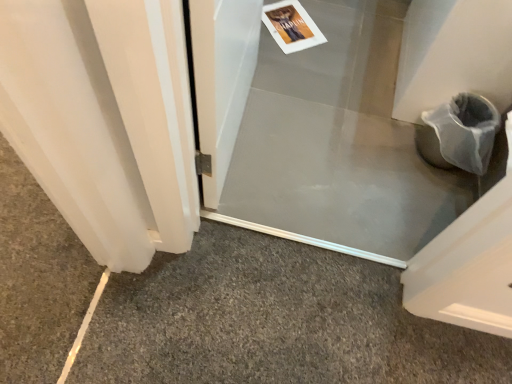
Describe the element at coordinates (222, 79) in the screenshot. Image resolution: width=512 pixels, height=384 pixels. I see `clear plastic screen door at center, the second screen door positioned from the back` at that location.

Where is `clear plastic screen door at center, marked as the 1th screen door in a front-to-back arrangement`? Image resolution: width=512 pixels, height=384 pixels. clear plastic screen door at center, marked as the 1th screen door in a front-to-back arrangement is located at coordinates (222, 79).

From a real-world perspective, is gray carpet at lower left located higher than clear plastic screen door at center, the second screen door positioned from the back?

No, from a real-world perspective, gray carpet at lower left is not above clear plastic screen door at center, the second screen door positioned from the back.

Is gray carpet at lower left not near clear plastic screen door at center, marked as the 1th screen door in a front-to-back arrangement?

No, there isn't a large distance between gray carpet at lower left and clear plastic screen door at center, marked as the 1th screen door in a front-to-back arrangement.

Considering the relative positions of gray carpet at lower left and clear plastic screen door at center, marked as the 1th screen door in a front-to-back arrangement, in the image provided, is gray carpet at lower left to the left or to the right of clear plastic screen door at center, marked as the 1th screen door in a front-to-back arrangement,?

From the image, it's evident that gray carpet at lower left is to the right of clear plastic screen door at center, marked as the 1th screen door in a front-to-back arrangement.

In the scene shown: From the image's perspective, which one is positioned lower, gray carpet at lower left or clear plastic screen door at center, the second screen door positioned from the back?

From the image's view, gray carpet at lower left is below.

Does clear plastic screen door at center, the second screen door positioned from the back, contain transparent plastic screen door at center, which is counted as the 1th screen door, starting from the back?

No, transparent plastic screen door at center, which is counted as the 1th screen door, starting from the back, is not a part of clear plastic screen door at center, the second screen door positioned from the back.

Can you tell me how much clear plastic screen door at center, marked as the 1th screen door in a front-to-back arrangement, and transparent plastic screen door at center, which ranks as the 2th screen door in front-to-back order, differ in facing direction?

The angle between the facing direction of clear plastic screen door at center, marked as the 1th screen door in a front-to-back arrangement, and the facing direction of transparent plastic screen door at center, which ranks as the 2th screen door in front-to-back order, is 93.1 degrees.

From a real-world perspective, is clear plastic screen door at center, marked as the 1th screen door in a front-to-back arrangement, under transparent plastic screen door at center, which is counted as the 1th screen door, starting from the back?

Actually, clear plastic screen door at center, marked as the 1th screen door in a front-to-back arrangement, is physically above transparent plastic screen door at center, which is counted as the 1th screen door, starting from the back, in the real world.

From the image's perspective, is clear plastic screen door at center, the second screen door positioned from the back, under transparent plastic screen door at center, which is counted as the 1th screen door, starting from the back?

Yes.

How much distance is there between gray carpet at lower left and transparent plastic screen door at center, which is counted as the 1th screen door, starting from the back?

A distance of 19.21 inches exists between gray carpet at lower left and transparent plastic screen door at center, which is counted as the 1th screen door, starting from the back.

In terms of height, does gray carpet at lower left look taller or shorter compared to transparent plastic screen door at center, which ranks as the 2th screen door in front-to-back order?

In the image, gray carpet at lower left appears to be taller than transparent plastic screen door at center, which ranks as the 2th screen door in front-to-back order.

You are a GUI agent. You are given a task and a screenshot of the screen. Output one action in this format:
    pyautogui.click(x=<x>, y=<y>)
    Task: Click on the concrete below the transparent plastic screen door at center, which is counted as the 1th screen door, starting from the back (from the image's perspective)
    
    Given the screenshot: What is the action you would take?
    pyautogui.click(x=273, y=321)

From the image's perspective, does gray carpet at lower left appear higher than transparent plastic screen door at center, which ranks as the 2th screen door in front-to-back order?

No, from the image's perspective, gray carpet at lower left is not above transparent plastic screen door at center, which ranks as the 2th screen door in front-to-back order.

Considering the relative positions of transparent plastic screen door at center, which ranks as the 2th screen door in front-to-back order, and gray carpet at lower left in the image provided, is transparent plastic screen door at center, which ranks as the 2th screen door in front-to-back order, to the left of gray carpet at lower left from the viewer's perspective?

No.

Is transparent plastic screen door at center, which is counted as the 1th screen door, starting from the back, not near gray carpet at lower left?

transparent plastic screen door at center, which is counted as the 1th screen door, starting from the back, is actually quite close to gray carpet at lower left.

Considering the sizes of objects transparent plastic screen door at center, which is counted as the 1th screen door, starting from the back, and gray carpet at lower left in the image provided, who is taller, transparent plastic screen door at center, which is counted as the 1th screen door, starting from the back, or gray carpet at lower left?

Standing taller between the two is gray carpet at lower left.

Which object is wider, transparent plastic screen door at center, which ranks as the 2th screen door in front-to-back order, or gray carpet at lower left?

transparent plastic screen door at center, which ranks as the 2th screen door in front-to-back order.

Can you confirm if transparent plastic screen door at center, which ranks as the 2th screen door in front-to-back order, is shorter than clear plastic screen door at center, marked as the 1th screen door in a front-to-back arrangement?

Indeed, transparent plastic screen door at center, which ranks as the 2th screen door in front-to-back order, has a lesser height compared to clear plastic screen door at center, marked as the 1th screen door in a front-to-back arrangement.

Could you tell me if transparent plastic screen door at center, which ranks as the 2th screen door in front-to-back order, is turned towards clear plastic screen door at center, the second screen door positioned from the back?

No, transparent plastic screen door at center, which ranks as the 2th screen door in front-to-back order, is not oriented towards clear plastic screen door at center, the second screen door positioned from the back.

Considering the relative positions of transparent plastic screen door at center, which ranks as the 2th screen door in front-to-back order, and clear plastic screen door at center, the second screen door positioned from the back, in the image provided, is transparent plastic screen door at center, which ranks as the 2th screen door in front-to-back order, to the left of clear plastic screen door at center, the second screen door positioned from the back, from the viewer's perspective?

No, transparent plastic screen door at center, which ranks as the 2th screen door in front-to-back order, is not to the left of clear plastic screen door at center, the second screen door positioned from the back.

Measure the distance from transparent plastic screen door at center, which is counted as the 1th screen door, starting from the back, to clear plastic screen door at center, marked as the 1th screen door in a front-to-back arrangement.

16.33 inches.

Is clear plastic screen door at center, the second screen door positioned from the back, looking in the opposite direction of gray carpet at lower left?

No.

From the image's perspective, does clear plastic screen door at center, marked as the 1th screen door in a front-to-back arrangement, appear lower than gray carpet at lower left?

No, from the image's perspective, clear plastic screen door at center, marked as the 1th screen door in a front-to-back arrangement, is not below gray carpet at lower left.

I want to click on concrete lying behind the clear plastic screen door at center, marked as the 1th screen door in a front-to-back arrangement, so [273, 321].

Who is smaller, clear plastic screen door at center, the second screen door positioned from the back, or gray carpet at lower left?

gray carpet at lower left.

This screenshot has width=512, height=384. Find the location of `screen door above the gray carpet at lower left (from a real-world perspective)`. screen door above the gray carpet at lower left (from a real-world perspective) is located at coordinates (222, 79).

Locate an element on the screen. Image resolution: width=512 pixels, height=384 pixels. screen door below the transparent plastic screen door at center, which ranks as the 2th screen door in front-to-back order (from the image's perspective) is located at coordinates (222, 79).

Estimate the real-world distances between objects in this image. Which object is further from clear plastic screen door at center, marked as the 1th screen door in a front-to-back arrangement, gray carpet at lower left or transparent plastic screen door at center, which ranks as the 2th screen door in front-to-back order?

gray carpet at lower left.

Which object lies nearer to the anchor point transparent plastic screen door at center, which is counted as the 1th screen door, starting from the back, clear plastic screen door at center, marked as the 1th screen door in a front-to-back arrangement, or gray carpet at lower left?

clear plastic screen door at center, marked as the 1th screen door in a front-to-back arrangement, lies closer to transparent plastic screen door at center, which is counted as the 1th screen door, starting from the back, than the other object.

Based on their spatial positions, is transparent plastic screen door at center, which ranks as the 2th screen door in front-to-back order, or gray carpet at lower left further from clear plastic screen door at center, the second screen door positioned from the back?

The object further to clear plastic screen door at center, the second screen door positioned from the back, is gray carpet at lower left.

Looking at the image, which one is located closer to gray carpet at lower left, clear plastic screen door at center, marked as the 1th screen door in a front-to-back arrangement, or transparent plastic screen door at center, which ranks as the 2th screen door in front-to-back order?

Based on the image, transparent plastic screen door at center, which ranks as the 2th screen door in front-to-back order, appears to be nearer to gray carpet at lower left.

From the image, which object appears to be farther from gray carpet at lower left, transparent plastic screen door at center, which ranks as the 2th screen door in front-to-back order, or clear plastic screen door at center, marked as the 1th screen door in a front-to-back arrangement?

clear plastic screen door at center, marked as the 1th screen door in a front-to-back arrangement.

Looking at the image, which one is located closer to transparent plastic screen door at center, which ranks as the 2th screen door in front-to-back order, gray carpet at lower left or clear plastic screen door at center, the second screen door positioned from the back?

Based on the image, clear plastic screen door at center, the second screen door positioned from the back, appears to be nearer to transparent plastic screen door at center, which ranks as the 2th screen door in front-to-back order.

Identify the location of screen door between transparent plastic screen door at center, which is counted as the 1th screen door, starting from the back, and gray carpet at lower left, in the vertical direction. (222, 79).